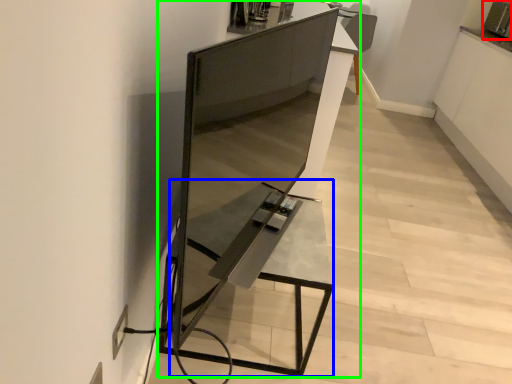
Question: Which object is the farthest from appliance (highlighted by a red box)? Choose among these: table (highlighted by a blue box) or furniture (highlighted by a green box).

Choices:
 (A) table
 (B) furniture

Answer: (A)